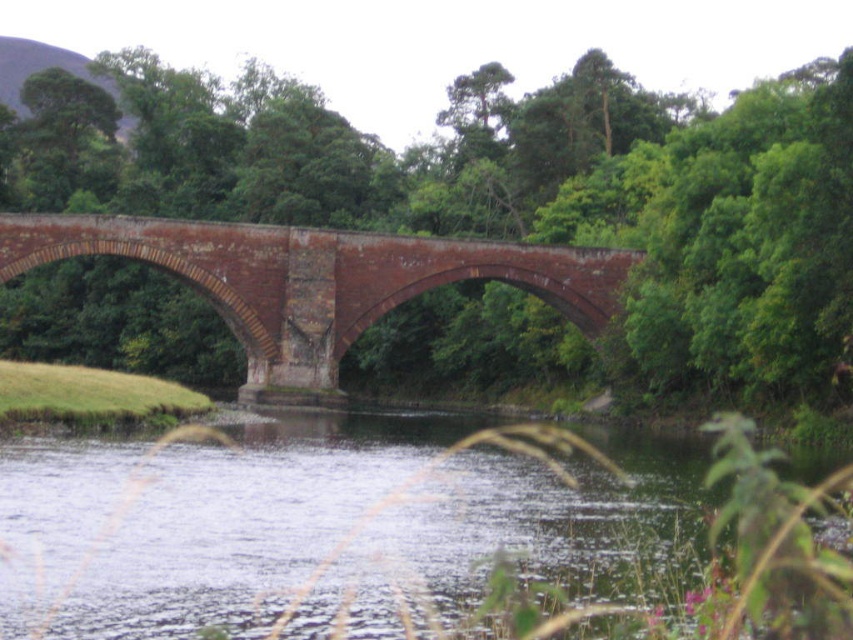
Question: Is green water at lower center closer to camera compared to brick bridge at center?

Choices:
 (A) yes
 (B) no

Answer: (A)

Question: Does green water at lower center appear on the right side of brick bridge at center?

Choices:
 (A) yes
 (B) no

Answer: (A)

Question: Among these objects, which one is nearest to the camera?

Choices:
 (A) green water at lower center
 (B) brick bridge at center

Answer: (A)

Question: Where is green water at lower center located in relation to brick bridge at center in the image?

Choices:
 (A) right
 (B) left

Answer: (A)